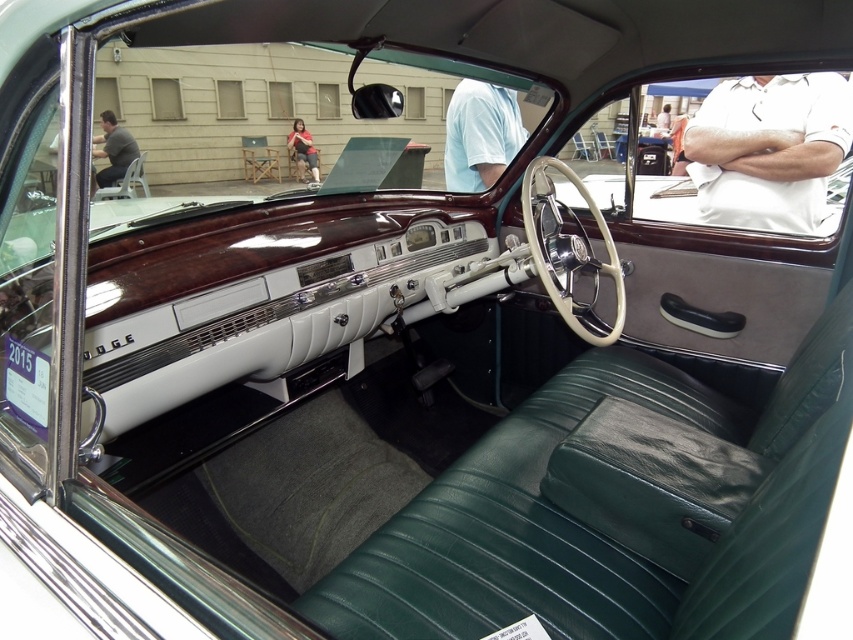
Measure the distance from white cotton shirt at upper right to gray fabric shirt at upper left.

The distance of white cotton shirt at upper right from gray fabric shirt at upper left is 8.47 meters.

Does white cotton shirt at upper right have a greater height compared to gray fabric shirt at upper left?

Incorrect, white cotton shirt at upper right's height is not larger of gray fabric shirt at upper left's.

Between point (833, 109) and point (97, 134), which one is positioned in front?

Point (833, 109)

The height and width of the screenshot is (640, 853). Identify the location of white cotton shirt at upper right. (769, 148).

Can you confirm if white cotton shirt at upper right is positioned above light blue fabric shirt at upper center?

Actually, white cotton shirt at upper right is below light blue fabric shirt at upper center.

Between white cotton shirt at upper right and light blue fabric shirt at upper center, which one has less height?

With less height is light blue fabric shirt at upper center.

What do you see at coordinates (769, 148) in the screenshot? I see `white cotton shirt at upper right` at bounding box center [769, 148].

Image resolution: width=853 pixels, height=640 pixels. I want to click on white cotton shirt at upper right, so pyautogui.click(x=769, y=148).

Is point (459, 128) positioned before point (109, 141)?

Yes, it is in front of point (109, 141).

Who is positioned more to the left, light blue fabric shirt at upper center or gray fabric shirt at upper left?

Positioned to the left is gray fabric shirt at upper left.

Between point (489, 106) and point (114, 154), which one is positioned in front?

Point (489, 106)

Where is `light blue fabric shirt at upper center`? This screenshot has width=853, height=640. light blue fabric shirt at upper center is located at coordinates (480, 134).